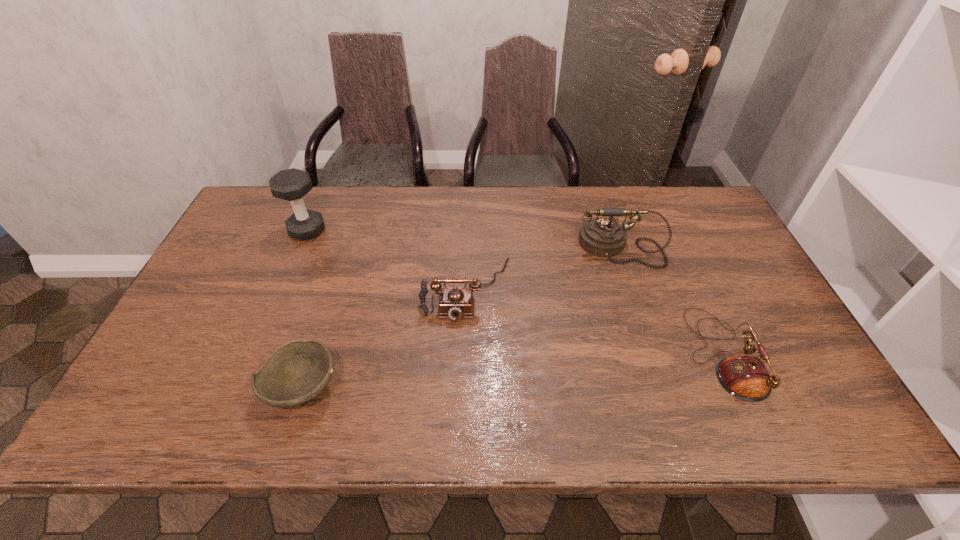
In order to click on telephone that is the third closest to the dumbbell in this screenshot , I will do `click(745, 377)`.